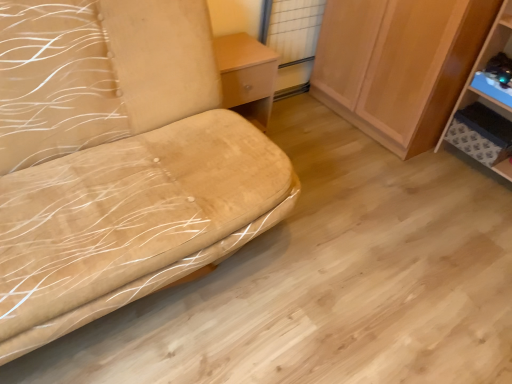
The width and height of the screenshot is (512, 384). I want to click on vacant space in front of wooden cabinet at right, so click(x=391, y=180).